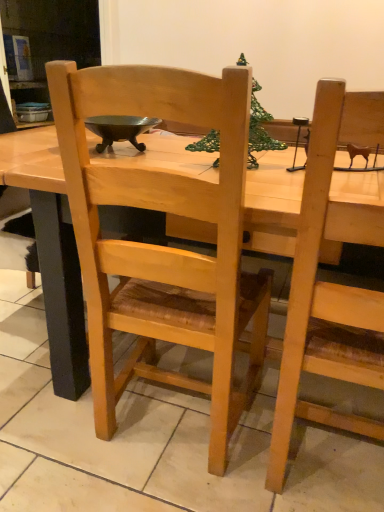
The image size is (384, 512). What do you see at coordinates (160, 246) in the screenshot? I see `natural wood chair at center` at bounding box center [160, 246].

You are a GUI agent. You are given a task and a screenshot of the screen. Output one action in this format:
    pyautogui.click(x=<x>, y=<y>)
    Task: Click on the natural wood chair at center
    The height and width of the screenshot is (512, 384).
    Given the screenshot: What is the action you would take?
    pyautogui.click(x=160, y=246)

Measure the distance between wooden table at center and camera.

The distance of wooden table at center from camera is 78.02 centimeters.

This screenshot has height=512, width=384. What are the coordinates of `wooden table at center` in the screenshot? It's located at (50, 250).

Describe the element at coordinates (50, 250) in the screenshot. I see `wooden table at center` at that location.

Locate an element on the screen. natural wood chair at center is located at coordinates (160, 246).

Considering the positions of objects wooden table at center and natural wood chair at center in the image provided, who is more to the left, wooden table at center or natural wood chair at center?

wooden table at center is more to the left.

Does wooden table at center come behind natural wood chair at center?

That is True.

Does point (285, 200) come farther from viewer compared to point (227, 362)?

No, it is not.

From the image's perspective, relative to natural wood chair at center, is wooden table at center above or below?

Clearly, from the image's perspective, wooden table at center is above natural wood chair at center.

In the scene shown: From a real-world perspective, which object rests below the other?

From a 3D spatial view, wooden table at center is below.

Which of these two, wooden table at center or natural wood chair at center, is wider?

wooden table at center is wider.

Is wooden table at center taller than natural wood chair at center?

Incorrect, the height of wooden table at center is not larger of that of natural wood chair at center.

Between wooden table at center and natural wood chair at center, which one has larger size?

wooden table at center.

Is natural wood chair at center surrounded by wooden table at center?

That's correct, natural wood chair at center is inside wooden table at center.

Is wooden table at center not close to natural wood chair at center?

No, there isn't a large distance between wooden table at center and natural wood chair at center.

Is wooden table at center facing towards natural wood chair at center?

Yes.

Can you tell me how much wooden table at center and natural wood chair at center differ in facing direction?

The angular difference between wooden table at center and natural wood chair at center is 177 degrees.

In order to click on chair above the wooden table at center (from a real-world perspective) in this screenshot , I will do `click(160, 246)`.

Does natural wood chair at center appear on the right side of wooden table at center?

Correct, you'll find natural wood chair at center to the right of wooden table at center.

Is natural wood chair at center in front of wooden table at center?

Yes, the depth of natural wood chair at center is less than that of wooden table at center.

Which is behind, point (161, 72) or point (351, 236)?

The point (351, 236) is farther from the camera.

From the image's perspective, which object appears higher, natural wood chair at center or wooden table at center?

wooden table at center appears higher in the image.

From a real-world perspective, is natural wood chair at center positioned above or below wooden table at center?

natural wood chair at center is situated higher than wooden table at center in the real world.

Considering the sizes of objects natural wood chair at center and wooden table at center in the image provided, who is wider, natural wood chair at center or wooden table at center?

Wider between the two is wooden table at center.

Considering the relative sizes of natural wood chair at center and wooden table at center in the image provided, is natural wood chair at center taller than wooden table at center?

Indeed, natural wood chair at center has a greater height compared to wooden table at center.

Consider the image. Between natural wood chair at center and wooden table at center, which one has larger size?

With larger size is wooden table at center.

Is wooden table at center a part of natural wood chair at center?

Actually, wooden table at center is outside natural wood chair at center.

Is natural wood chair at center in contact with wooden table at center?

No, natural wood chair at center is not in contact with wooden table at center.

Could you tell me if natural wood chair at center is turned towards wooden table at center?

Yes, natural wood chair at center is turned towards wooden table at center.

Measure the distance from natural wood chair at center to wooden table at center.

natural wood chair at center is 10.14 inches from wooden table at center.

What are the coordinates of `chair in front of the wooden table at center` in the screenshot? It's located at (160, 246).

You are a GUI agent. You are given a task and a screenshot of the screen. Output one action in this format:
    pyautogui.click(x=<x>, y=<y>)
    Task: Click on the desk behind the natural wood chair at center
    Image resolution: width=384 pixels, height=512 pixels.
    Given the screenshot: What is the action you would take?
    pyautogui.click(x=50, y=250)

Where is `chair lying on the right of wooden table at center`? chair lying on the right of wooden table at center is located at coordinates (160, 246).